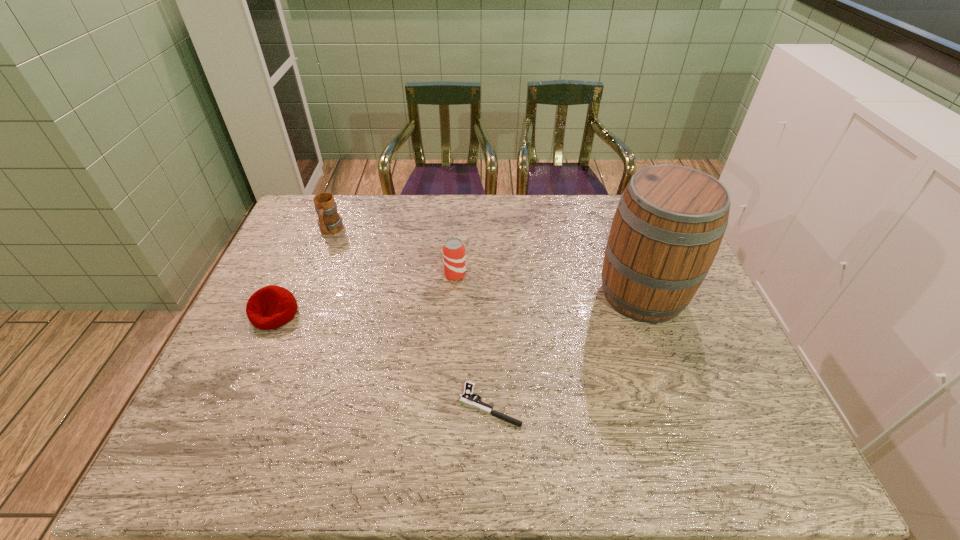
Identify the location of free region at the near edge of the desktop. Image resolution: width=960 pixels, height=540 pixels. (457, 443).

Identify the location of blank space at the left edge. (261, 334).

In order to click on free space at the right edge of the desktop in this screenshot , I will do `click(697, 327)`.

In the image, there is a desktop. Identify the location of free region at the far left corner. This screenshot has width=960, height=540. (340, 212).

Find the location of a particular element. The image size is (960, 540). vacant space at the far right corner of the desktop is located at coordinates (612, 196).

Where is `free region at the near right corner of the desktop`? This screenshot has width=960, height=540. free region at the near right corner of the desktop is located at coordinates (773, 455).

Identify the location of free point between the second shortest object and the shortest object. The width and height of the screenshot is (960, 540). (382, 359).

This screenshot has width=960, height=540. In order to click on vacant space in between the mug and the beanbag in this screenshot , I will do `click(302, 272)`.

What are the coordinates of `empty space between the beanbag and the nearest object` in the screenshot? It's located at (382, 359).

This screenshot has height=540, width=960. Identify the location of vacant space in between the second shortest object and the mug. (x=302, y=272).